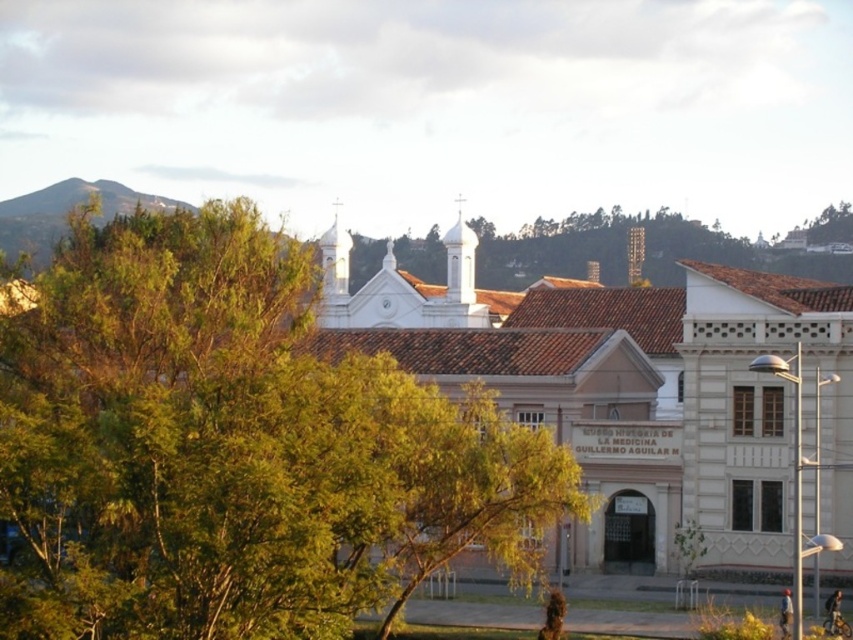
Question: Can you confirm if green leafy tree at center is smaller than brick bell tower at upper center?

Choices:
 (A) yes
 (B) no

Answer: (B)

Question: Which object is farther from the camera taking this photo?

Choices:
 (A) brick bell tower at upper center
 (B) green leafy tree at center

Answer: (A)

Question: Considering the relative positions of green leafy tree at center and brick bell tower at upper center in the image provided, where is green leafy tree at center located with respect to brick bell tower at upper center?

Choices:
 (A) below
 (B) above

Answer: (A)

Question: Can you confirm if green leafy tree at center is bigger than white smooth bell tower at upper center?

Choices:
 (A) yes
 (B) no

Answer: (A)

Question: Which object is the closest to the brick bell tower at upper center?

Choices:
 (A) white smooth bell tower at upper center
 (B) green leafy tree at center

Answer: (A)

Question: Among these points, which one is farthest from the camera?

Choices:
 (A) (637, 257)
 (B) (225, 356)

Answer: (A)